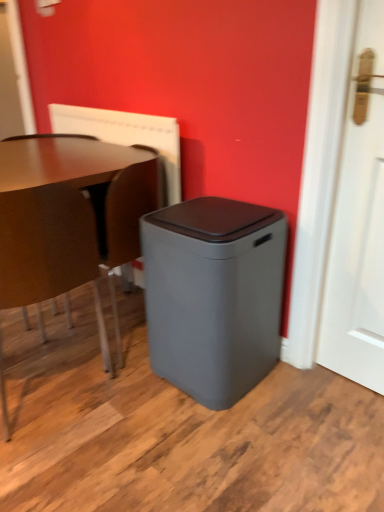
Where is `free area in between white matte door at right and gray matte waste container at center`? This screenshot has height=512, width=384. free area in between white matte door at right and gray matte waste container at center is located at coordinates (299, 394).